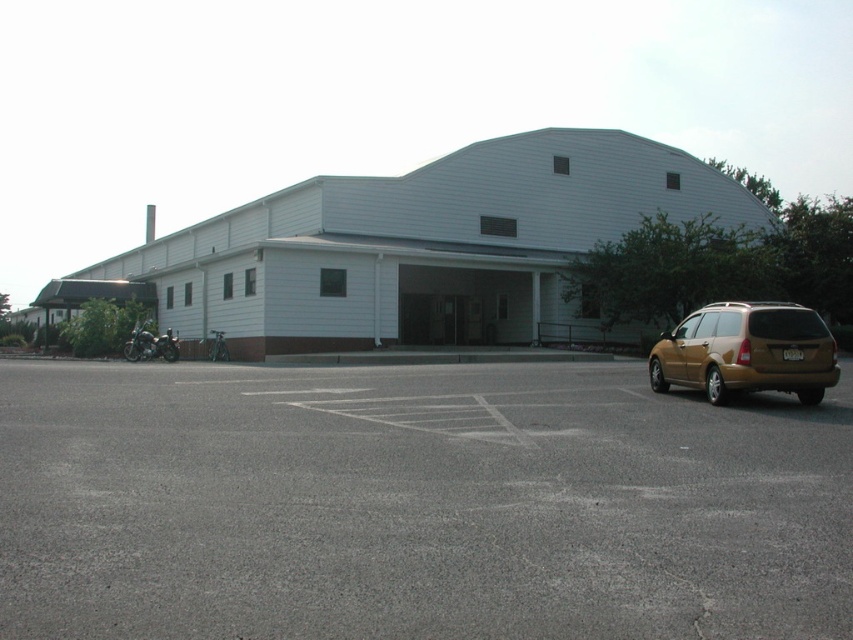
You are a delivery driver arriving at the building and need to park your vehicle. The parking lot has designated spaces. Based on the scene, where would you find the gold metallic suv at right relative to the gray asphalt parking lot at center?

The gold metallic suv at right is located to the right of the gray asphalt parking lot at center, as the parking lot is to the left of the suv according to the description.

You are a delivery driver who needs to park your truck, which is 6 meters long, in the parking lot shown in the image. The gold metallic suv at right is already occupying a spot. Can you fit your truck in the remaining space of the gray asphalt parking lot at center?

The gray asphalt parking lot at center is smaller than the gold metallic suv at right. Since the SUV is already taking up space, the remaining area might not be sufficient for a 6 meter truck. Check for other available spots.